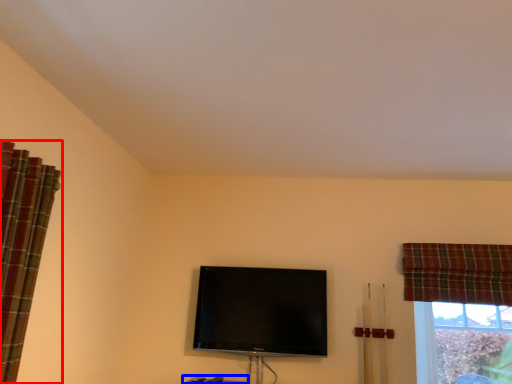
Question: Which object is closer to the camera taking this photo, curtain (highlighted by a red box) or furniture (highlighted by a blue box)?

Choices:
 (A) curtain
 (B) furniture

Answer: (A)